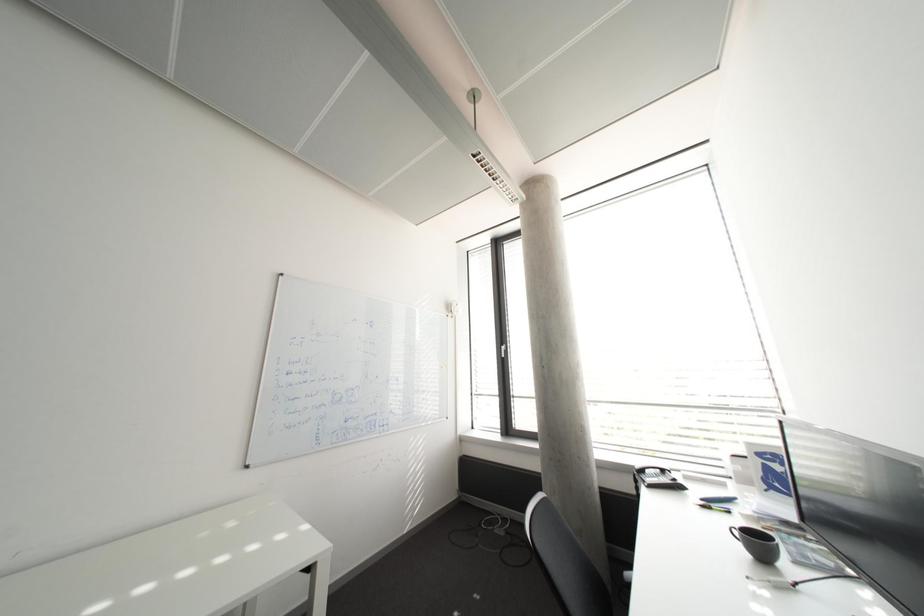
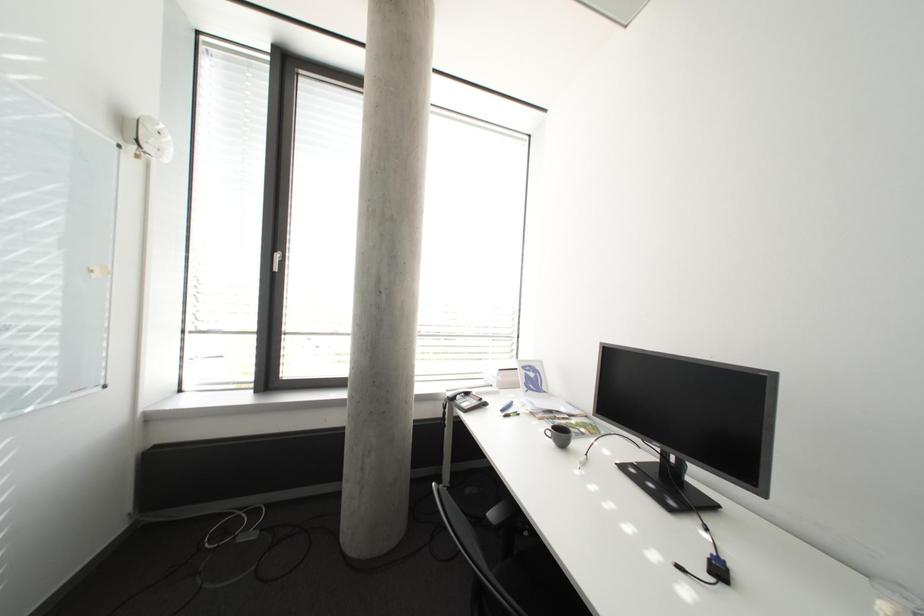
Question: How did the camera likely rotate?

Choices:
 (A) Left
 (B) Right
 (C) Up
 (D) Down

Answer: (B)